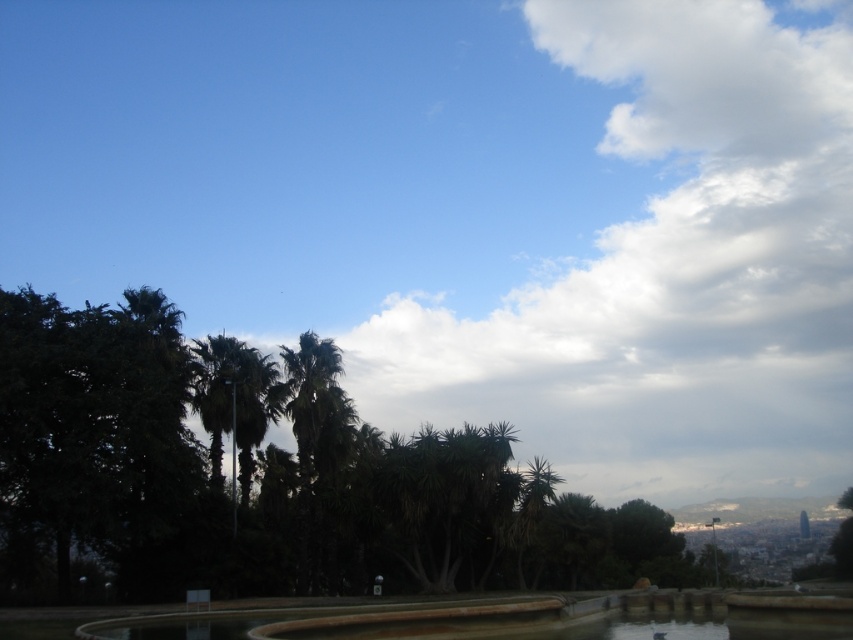
Which is behind, point (670, 592) or point (250, 365)?

The point (250, 365) is behind.

Does point (498, 611) lie in front of point (223, 412)?

Yes, point (498, 611) is in front of point (223, 412).

This screenshot has width=853, height=640. Describe the element at coordinates (511, 618) in the screenshot. I see `brown stone fountain at lower center` at that location.

In order to click on brown stone fountain at lower center in this screenshot , I will do `click(511, 618)`.

Between point (189, 380) and point (422, 625), which one is positioned behind?

The point (189, 380) is behind.

Does point (337, 416) lie behind point (668, 608)?

Yes, it is behind point (668, 608).

Which is behind, point (488, 484) or point (357, 614)?

Positioned behind is point (488, 484).

The height and width of the screenshot is (640, 853). I want to click on green leafy tree at center, so click(x=265, y=476).

Does green leafy tree at center appear on the right side of green leafy palm tree at left?

Indeed, green leafy tree at center is positioned on the right side of green leafy palm tree at left.

Where is `green leafy tree at center`? green leafy tree at center is located at coordinates (265, 476).

Who is more forward, [480,586] or [256,349]?

Point [480,586]

Locate an element on the screen. This screenshot has height=640, width=853. green leafy tree at center is located at coordinates (265, 476).